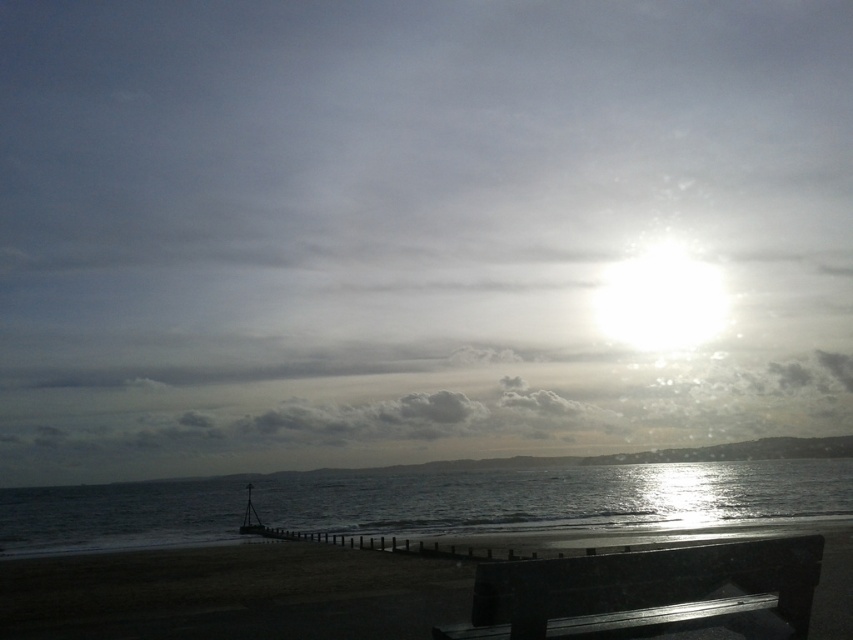
You are a photographer trying to capture the perfect shot of the beach scene. You want to ensure the shiny metallic water at lower center and the dark sand at lower center are both visible in your frame. Based on their positions, which object will appear larger in the photo?

The shiny metallic water at lower center appears larger because it is much taller than the dark sand at lower center.

You are standing on the beach and want to sit down on the black polished wood bench at lower center. However, there is a large puddle of shiny metallic water at lower center in front of it. Can you sit on the bench without stepping into the puddle?

The shiny metallic water at lower center is bigger than the black polished wood bench at lower center, so the puddle is larger than the bench. You might need to step around the puddle to reach the bench safely.

From the picture: You are standing at the wooden bench facing the ocean. There is a shiny metallic water at lower center located at point (427, 502). Can you see the shiny metallic water at lower center from your current position?

Yes, the shiny metallic water at lower center is located at point (427, 502), so you can see it from your position at the wooden bench facing the ocean.